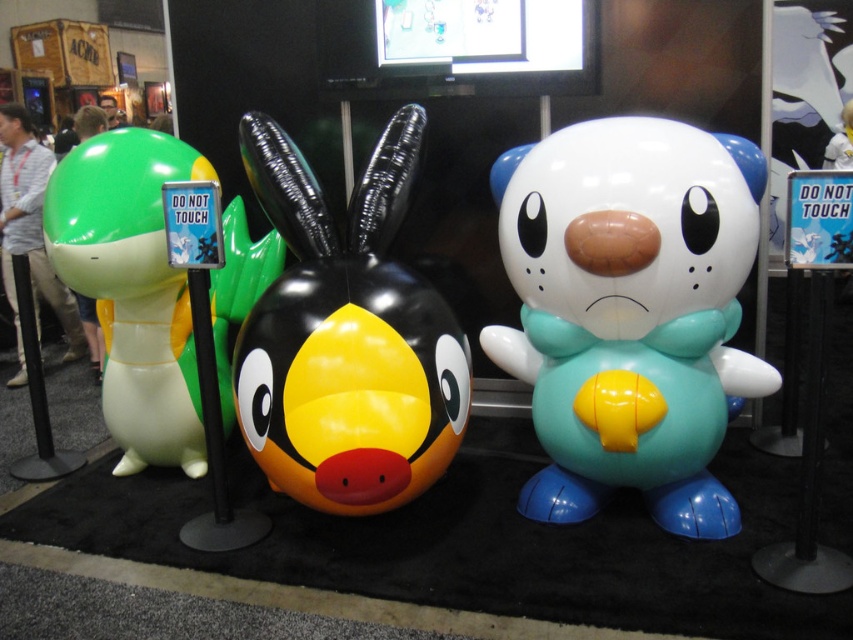
Looking at this image, you are a child who wants to hug both the teal rubber plush at center and the green rubber turtle at left. Can you reach both without moving your feet?

The teal rubber plush at center and the green rubber turtle at left are 1.42 meters apart. If the child can reach 1.42 meters or more, they can reach both without moving their feet. However, typical arm span for a child is about 1 meter, so it might be difficult.

You are setting up a display for a childrens event and need to arrange the teal rubber plush at center and the green rubber turtle at left. The event requires that the larger object be placed in a corner for visibility. Which object should you place in the corner?

The green rubber turtle at left should be placed in the corner because it occupies more space than the teal rubber plush at center.

What is the color of the object at point (630, 310)?

The object at point (630, 310) is teal rubber plush.